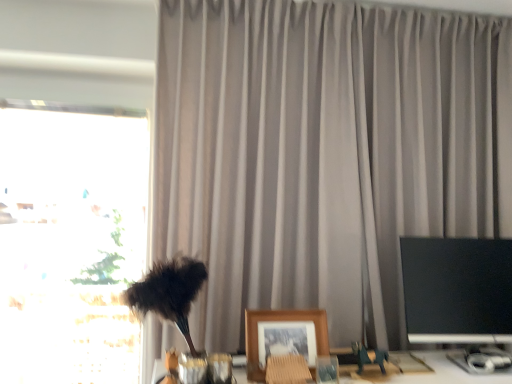
Identify the location of matte gray curtain at center. Image resolution: width=512 pixels, height=384 pixels. (322, 153).

The height and width of the screenshot is (384, 512). In order to click on transparent glass window at left in this screenshot , I will do `click(71, 244)`.

What are the coordinates of `black glossy monitor at right` in the screenshot? It's located at (460, 297).

The width and height of the screenshot is (512, 384). In order to click on wooden framed photo at center in this screenshot , I will do `click(283, 337)`.

From a real-world perspective, which is physically below, wooden framed photo at center or black glossy monitor at right?

In real-world perspective, wooden framed photo at center is lower.

Is wooden framed photo at center positioned with its back to black glossy monitor at right?

No, black glossy monitor at right is not at the back of wooden framed photo at center.

Can you confirm if wooden framed photo at center is taller than black glossy monitor at right?

No, wooden framed photo at center is not taller than black glossy monitor at right.

Can you confirm if wooden framed photo at center is positioned to the left of black glossy monitor at right?

Correct, you'll find wooden framed photo at center to the left of black glossy monitor at right.

Is transparent glass window at left bigger than matte gray curtain at center?

No.

Is transparent glass window at left taller or shorter than matte gray curtain at center?

Considering their sizes, transparent glass window at left has less height than matte gray curtain at center.

Could you tell me if transparent glass window at left is facing matte gray curtain at center?

No, transparent glass window at left is not oriented towards matte gray curtain at center.

Considering the positions of objects transparent glass window at left and matte gray curtain at center in the image provided, who is more to the right, transparent glass window at left or matte gray curtain at center?

matte gray curtain at center is more to the right.

Measure the distance between metallic green toy horse at lower right and transparent glass window at left.

1.16 meters.

Could you tell me if metallic green toy horse at lower right is turned towards transparent glass window at left?

No, metallic green toy horse at lower right is not turned towards transparent glass window at left.

Can you tell me how much metallic green toy horse at lower right and transparent glass window at left differ in facing direction?

The angular difference between metallic green toy horse at lower right and transparent glass window at left is 0.000301 degrees.

Would you say transparent glass window at left is part of metallic green toy horse at lower right's contents?

No, transparent glass window at left is not surrounded by metallic green toy horse at lower right.

In the scene shown: Is matte gray curtain at center surrounded by black glossy monitor at right?

No, matte gray curtain at center is not surrounded by black glossy monitor at right.

Considering the sizes of objects black glossy monitor at right and matte gray curtain at center in the image provided, who is smaller, black glossy monitor at right or matte gray curtain at center?

With smaller size is black glossy monitor at right.

Is the surface of black glossy monitor at right in direct contact with matte gray curtain at center?

black glossy monitor at right and matte gray curtain at center are clearly separated.

Considering the sizes of objects black glossy monitor at right and transparent glass window at left in the image provided, who is wider, black glossy monitor at right or transparent glass window at left?

transparent glass window at left.

Does black glossy monitor at right have a greater height compared to transparent glass window at left?

No.

From the image's perspective, which is below, black glossy monitor at right or transparent glass window at left?

black glossy monitor at right, from the image's perspective.

Measure the distance between wooden framed photo at center and matte gray curtain at center.

wooden framed photo at center is 56.72 centimeters from matte gray curtain at center.

Can matte gray curtain at center be found inside wooden framed photo at center?

No, matte gray curtain at center is located outside of wooden framed photo at center.

Is wooden framed photo at center facing towards matte gray curtain at center?

No, wooden framed photo at center does not turn towards matte gray curtain at center.

Which object is positioned more to the left, wooden framed photo at center or matte gray curtain at center?

wooden framed photo at center is more to the left.

Looking at this image, can you confirm if transparent glass window at left is wider than black glossy monitor at right?

Correct, the width of transparent glass window at left exceeds that of black glossy monitor at right.

In the scene shown: Is black glossy monitor at right at the back of transparent glass window at left?

transparent glass window at left is not turned away from black glossy monitor at right.

From the image's perspective, would you say transparent glass window at left is shown under black glossy monitor at right?

Incorrect, from the image's perspective, transparent glass window at left is higher than black glossy monitor at right.

In order to click on computer monitor above the wooden framed photo at center (from the image's perspective) in this screenshot , I will do point(460,297).

Find the location of a particular element. window below the matte gray curtain at center (from the image's perspective) is located at coordinates (71, 244).

From the image, which object appears to be nearer to matte gray curtain at center, wooden framed photo at center or metallic green toy horse at lower right?

Based on the image, wooden framed photo at center appears to be nearer to matte gray curtain at center.

Estimate the real-world distances between objects in this image. Which object is closer to matte gray curtain at center, metallic green toy horse at lower right or transparent glass window at left?

transparent glass window at left.

From the image, which object appears to be farther from matte gray curtain at center, black glossy monitor at right or transparent glass window at left?

Based on the image, transparent glass window at left appears to be further to matte gray curtain at center.

Looking at the image, which one is located closer to metallic green toy horse at lower right, matte gray curtain at center or wooden framed photo at center?

wooden framed photo at center is closer to metallic green toy horse at lower right.

From the image, which object appears to be farther from metallic green toy horse at lower right, transparent glass window at left or matte gray curtain at center?

transparent glass window at left is positioned further to the anchor metallic green toy horse at lower right.

From the image, which object appears to be farther from metallic green toy horse at lower right, wooden framed photo at center or transparent glass window at left?

transparent glass window at left is positioned further to the anchor metallic green toy horse at lower right.

Based on the photo, estimate the real-world distances between objects in this image. Which object is further from black glossy monitor at right, transparent glass window at left or metallic green toy horse at lower right?

Based on the image, transparent glass window at left appears to be further to black glossy monitor at right.

Considering their positions, is transparent glass window at left positioned closer to matte gray curtain at center than wooden framed photo at center?

wooden framed photo at center.

Image resolution: width=512 pixels, height=384 pixels. I want to click on curtain situated between transparent glass window at left and black glossy monitor at right from left to right, so click(x=322, y=153).

Identify the location of curtain between wooden framed photo at center and black glossy monitor at right from left to right. (322, 153).

The image size is (512, 384). What are the coordinates of `picture frame located between transparent glass window at left and metallic green toy horse at lower right in the left-right direction` in the screenshot? It's located at (283, 337).

In order to click on picture frame situated between transparent glass window at left and black glossy monitor at right from left to right in this screenshot , I will do `click(283, 337)`.